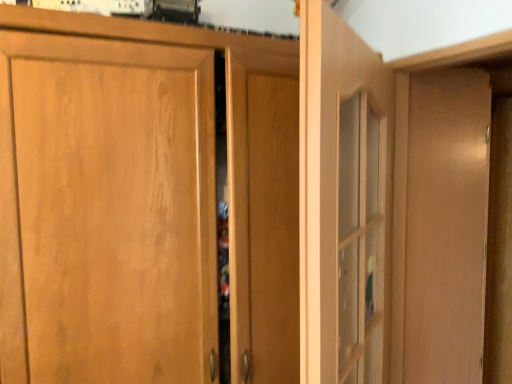
Question: Is clear glass door at center, the first door from the right, spatially inside wooden cabinet door at center, the second door viewed from the right, or outside of it?

Choices:
 (A) outside
 (B) inside

Answer: (A)

Question: From the image's perspective, is clear glass door at center, the second door viewed from the left, above or below wooden cabinet door at center, the second door viewed from the right?

Choices:
 (A) above
 (B) below

Answer: (A)

Question: Which of these objects is positioned farthest from the matte wood dresser at right?

Choices:
 (A) clear glass door at center, the second door viewed from the left
 (B) wooden cabinet door at center, the second door viewed from the right

Answer: (B)

Question: Which of these objects is positioned farthest from the wooden cabinet door at center, marked as the first door in a left-to-right arrangement?

Choices:
 (A) clear glass door at center, the second door viewed from the left
 (B) matte wood dresser at right

Answer: (B)